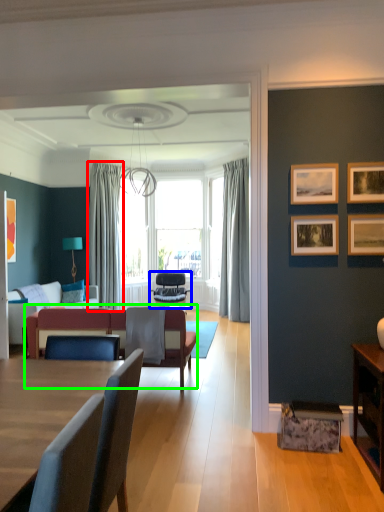
Question: Which object is the closest to the curtain (highlighted by a red box)? Choose among these: chair (highlighted by a blue box) or couch (highlighted by a green box).

Choices:
 (A) chair
 (B) couch

Answer: (A)